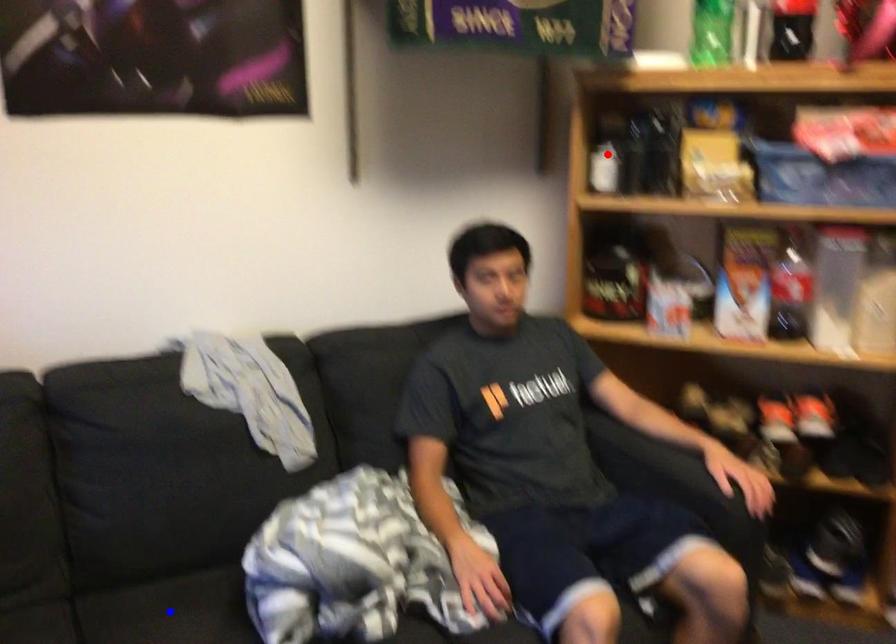
Question: Which of the two points in the image is closer to the camera?

Choices:
 (A) Blue point is closer.
 (B) Red point is closer.

Answer: (A)